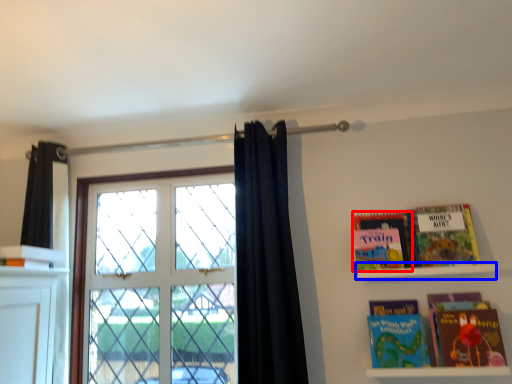
Question: Which of the following is the closest to the observer, book (highlighted by a red box) or shelf (highlighted by a blue box)?

Choices:
 (A) book
 (B) shelf

Answer: (B)